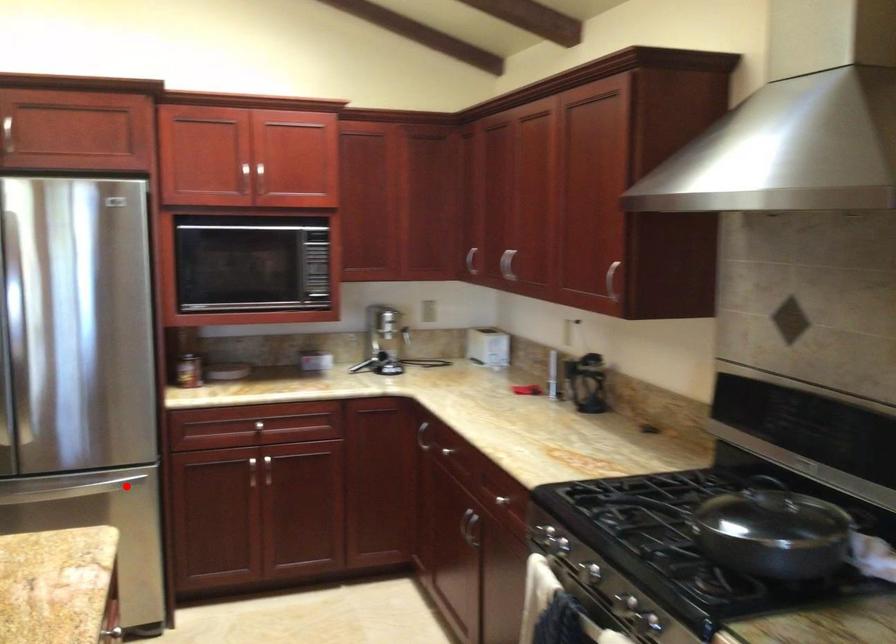
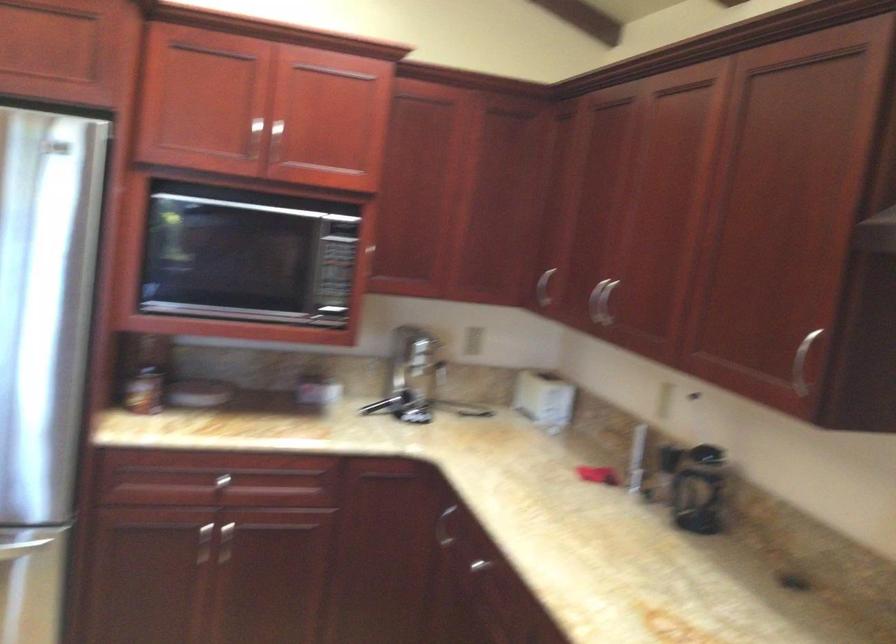
Where in the second image is the point corresponding to the highlighted location from the first image?

(21, 547)